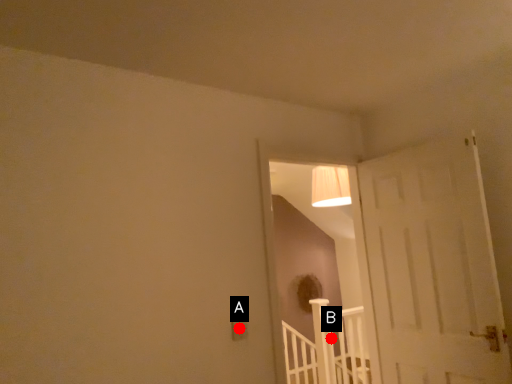
Question: Two points are circled on the image, labeled by A and B beside each circle. Which point is farther to the camera?

Choices:
 (A) A is further
 (B) B is further

Answer: (B)